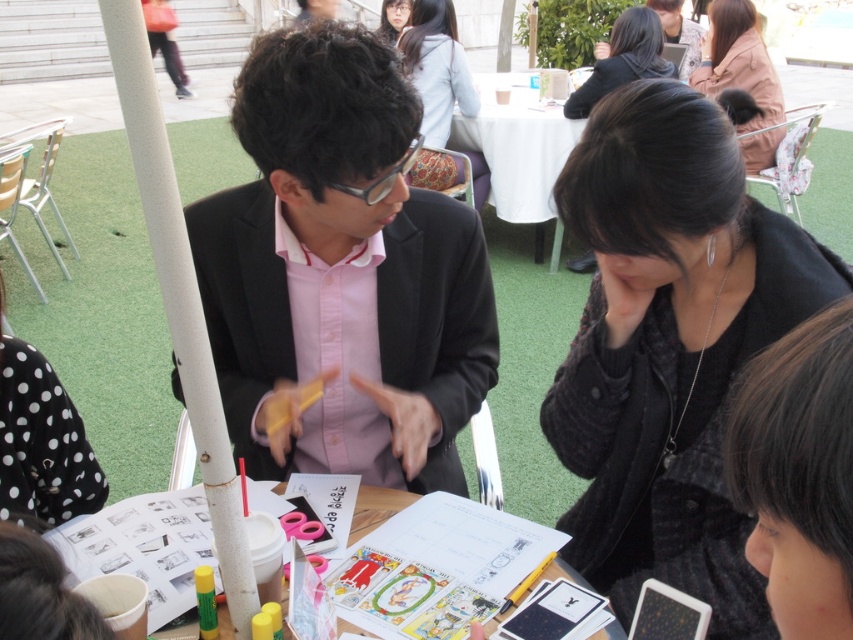
You are a photographer trying to capture a group photo of the matte black suit at center and the dark brown hair at lower right. Based on their positions, which object should you focus on first to ensure both are in frame?

You should focus on the matte black suit at center first because it is wider than the dark brown hair at lower right, so positioning the camera to include its broader width ensures the dark brown hair at lower right will also be captured within the frame.

You are a photographer trying to capture a candid shot of the matte black hair at upper center without including the brown fuzzy coat at upper right in the frame. Based on their positions, is this possible?

The brown fuzzy coat at upper right is below matte black hair at upper center, so if you position your camera to focus on the matte black hair at upper center and avoid the lower area where the brown fuzzy coat at upper right is located, it should be possible to capture the shot without including the coat.